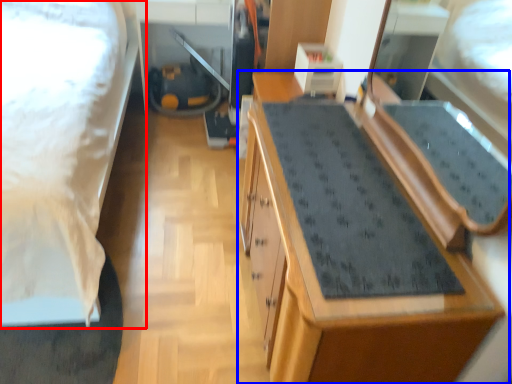
Question: Which of the following is the closest to the observer, bed (highlighted by a red box) or cabinetry (highlighted by a blue box)?

Choices:
 (A) bed
 (B) cabinetry

Answer: (A)